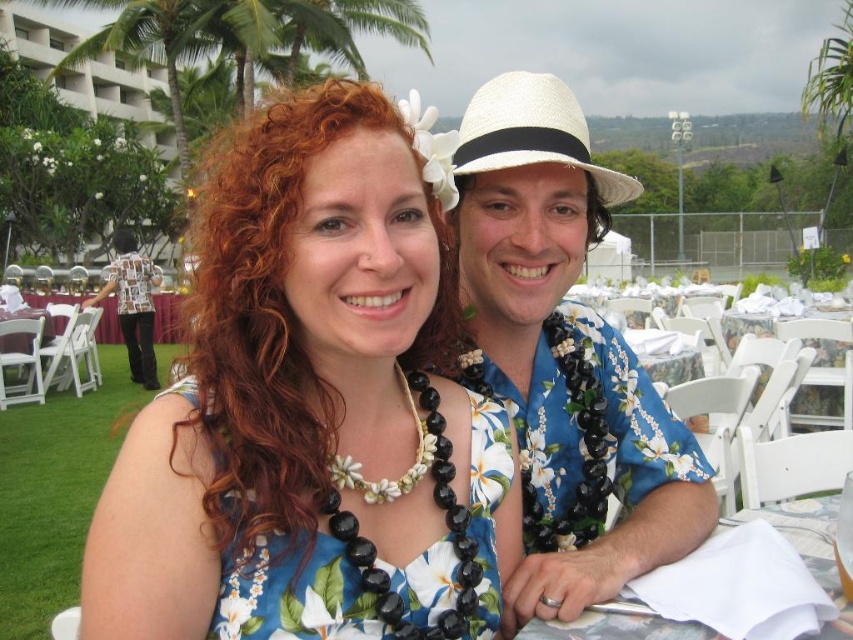
Question: Which object is the farthest from the floral shirt at center?

Choices:
 (A) white paper napkin at lower right
 (B) floral fabric dress at center

Answer: (A)

Question: Which of the following is the closest to the observer?

Choices:
 (A) (341, 413)
 (B) (463, 124)

Answer: (A)

Question: Can you confirm if floral shirt at center is positioned to the left of white paper napkin at lower right?

Choices:
 (A) no
 (B) yes

Answer: (B)

Question: Does floral dress at center have a lesser width compared to white paper napkin at lower right?

Choices:
 (A) yes
 (B) no

Answer: (A)

Question: Which of the following is the farthest from the observer?

Choices:
 (A) floral fabric dress at center
 (B) floral dress at center
 (C) white paper napkin at lower right
 (D) floral shirt at center

Answer: (D)

Question: Is floral shirt at center bigger than floral fabric dress at center?

Choices:
 (A) yes
 (B) no

Answer: (A)